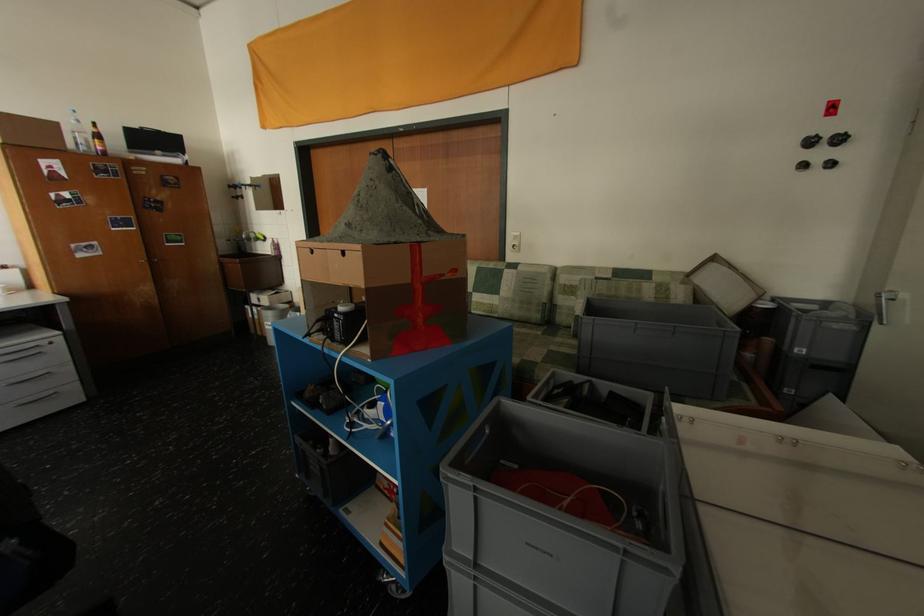
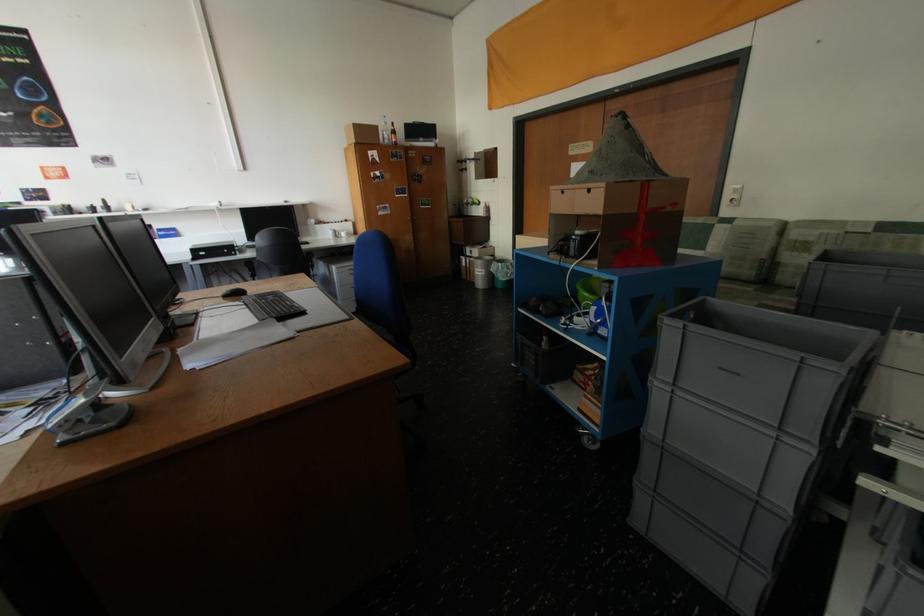
The point at (274, 323) is marked in the first image. Where is the corresponding point in the second image?

(484, 270)